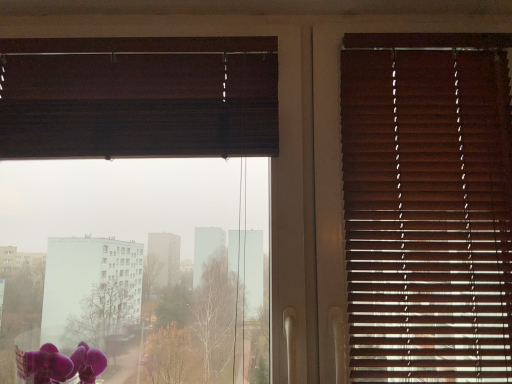
Where is `matte black window at center`? The height and width of the screenshot is (384, 512). matte black window at center is located at coordinates (142, 45).

Describe the element at coordinates (142, 45) in the screenshot. I see `matte black window at center` at that location.

Find the location of a particular element. The width and height of the screenshot is (512, 384). matte black window at center is located at coordinates (142, 45).